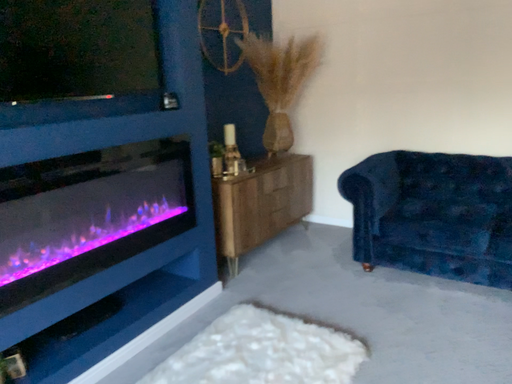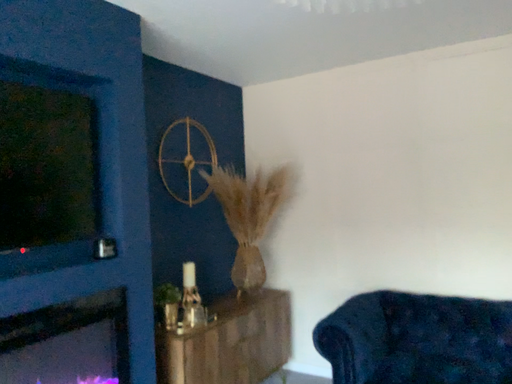
Question: Which way did the camera rotate in the video?

Choices:
 (A) rotated downward
 (B) rotated upward

Answer: (B)